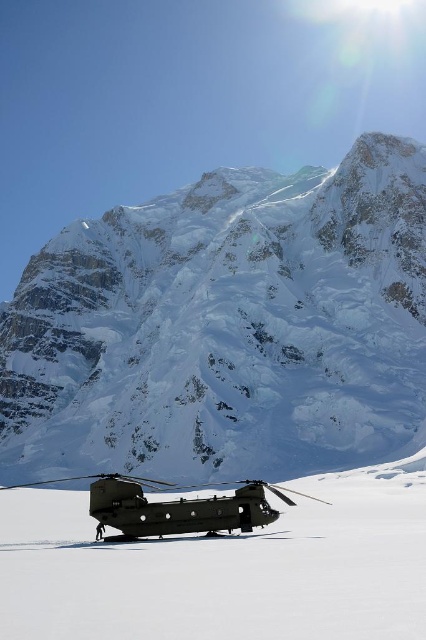
Question: Which object is positioned closest to the snowy granite mountain range at center?

Choices:
 (A) matte black helicopter at center
 (B) matte black helicopter at lower center

Answer: (A)

Question: Is matte black helicopter at lower center smaller than matte black helicopter at center?

Choices:
 (A) no
 (B) yes

Answer: (A)

Question: Which point is farther from the camera taking this photo?

Choices:
 (A) (5, 378)
 (B) (232, 525)
 (C) (227, 637)

Answer: (A)

Question: Can you confirm if snowy granite mountain range at center is thinner than matte black helicopter at lower center?

Choices:
 (A) no
 (B) yes

Answer: (A)

Question: Which object is positioned farthest from the snowy granite mountain range at center?

Choices:
 (A) matte black helicopter at center
 (B) matte black helicopter at lower center

Answer: (B)

Question: Can you confirm if snowy granite mountain range at center is positioned above matte black helicopter at lower center?

Choices:
 (A) yes
 (B) no

Answer: (A)